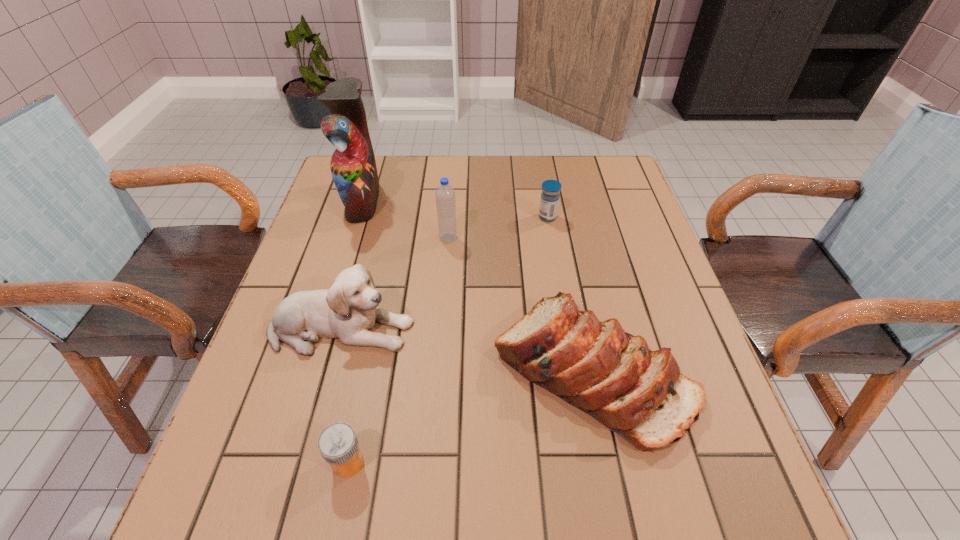
Where is `free spot that satisfies the following two spatial constraints: 1. at the face of the fourth tallest object; 2. on the right side of the parrot`? The width and height of the screenshot is (960, 540). free spot that satisfies the following two spatial constraints: 1. at the face of the fourth tallest object; 2. on the right side of the parrot is located at coordinates (309, 372).

Locate an element on the screen. vacant space that satisfies the following two spatial constraints: 1. on the front side of the third shortest object; 2. on the right side of the water bottle is located at coordinates (438, 372).

You are a GUI agent. You are given a task and a screenshot of the screen. Output one action in this format:
    pyautogui.click(x=<x>, y=<y>)
    Task: Click on the free point that satisfies the following two spatial constraints: 1. on the back side of the second shortest object; 2. on the right side of the third object from right to left
    
    Given the screenshot: What is the action you would take?
    pyautogui.click(x=449, y=217)